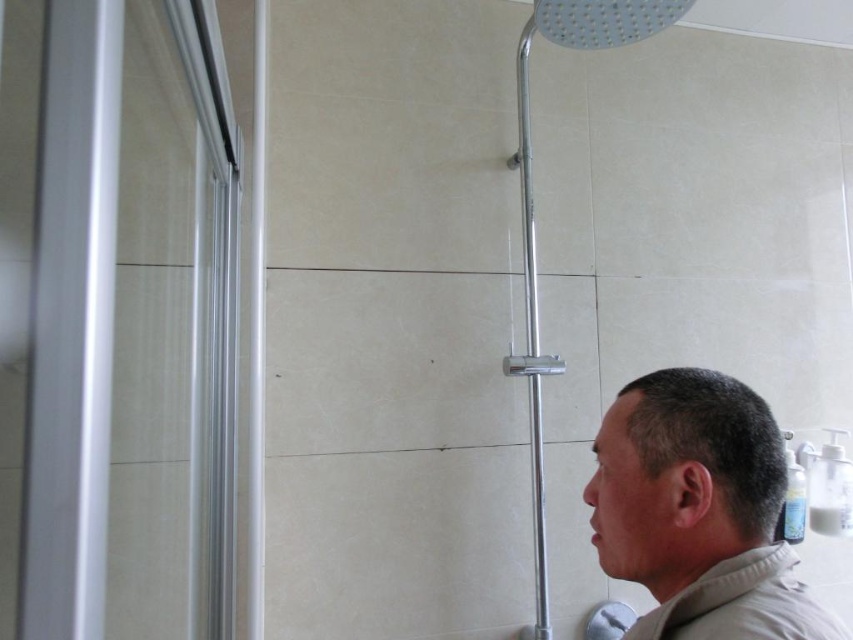
Is point (631, 20) positioned before point (788, 556)?

No.

Does transparent glass shower door at left appear over beige cotton robe at lower right?

Yes.

Identify the location of transparent glass shower door at left. (532, 209).

In the scene shown: Is transparent glass door at left further to camera compared to beige cotton robe at lower right?

No, transparent glass door at left is closer to the viewer.

Is transparent glass door at left to the right of beige cotton robe at lower right from the viewer's perspective?

In fact, transparent glass door at left is to the left of beige cotton robe at lower right.

You are a GUI agent. You are given a task and a screenshot of the screen. Output one action in this format:
    pyautogui.click(x=<x>, y=<y>)
    Task: Click on the transparent glass door at left
    The height and width of the screenshot is (640, 853).
    Given the screenshot: What is the action you would take?
    pyautogui.click(x=117, y=321)

Find the location of a particular element. The height and width of the screenshot is (640, 853). transparent glass door at left is located at coordinates (117, 321).

Where is `transparent glass door at left`? This screenshot has width=853, height=640. transparent glass door at left is located at coordinates (117, 321).

Between point (105, 468) and point (563, 26), which one is positioned behind?

Positioned behind is point (563, 26).

Between point (84, 326) and point (519, 632), which one is positioned behind?

Point (519, 632)

I want to click on transparent glass door at left, so click(x=117, y=321).